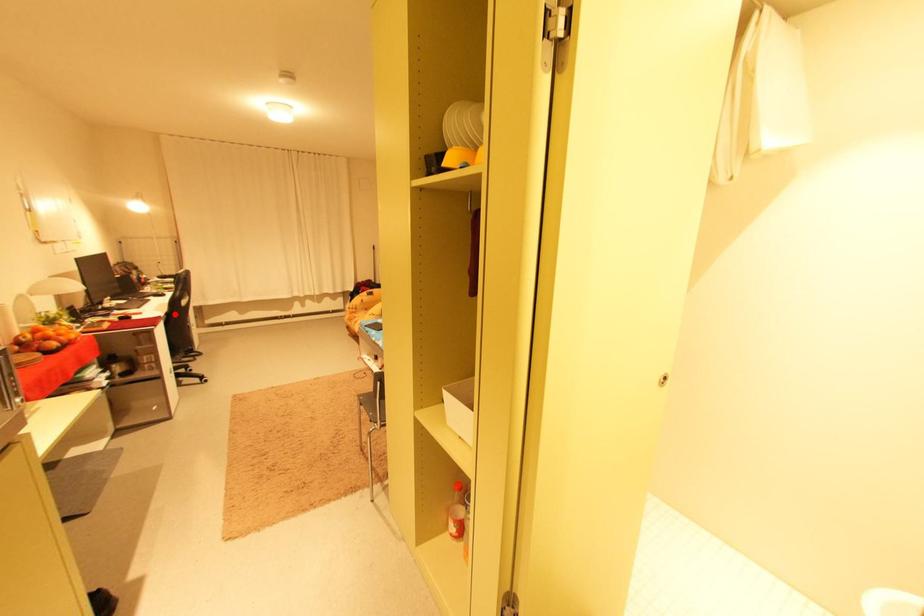
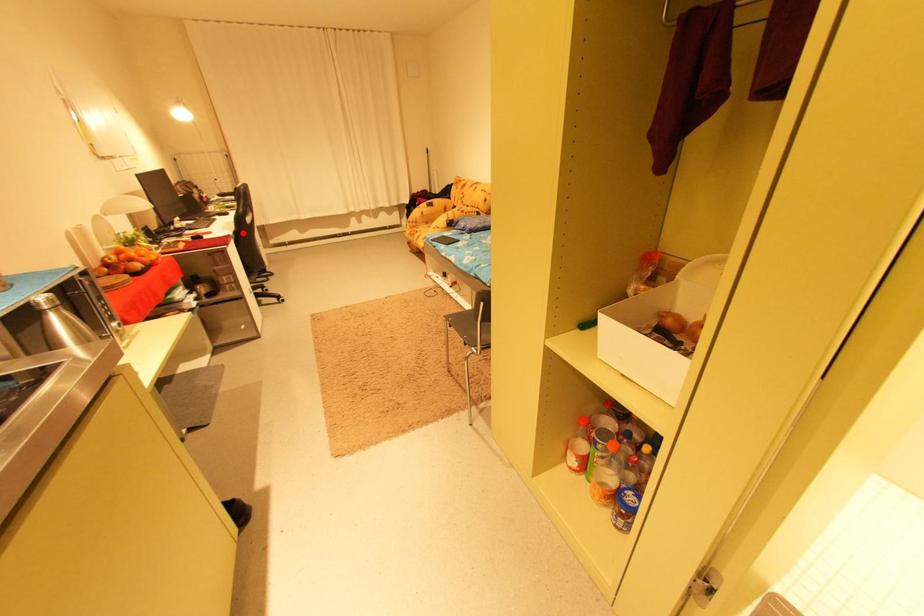
I am providing you with two images of the same scene from different viewpoints. A red point is marked on the first image and another point is marked on the second image. Do the highlighted points in image1 and image2 indicate the same real-world spot?

Yes